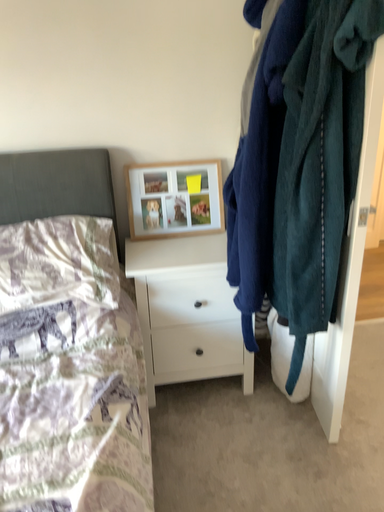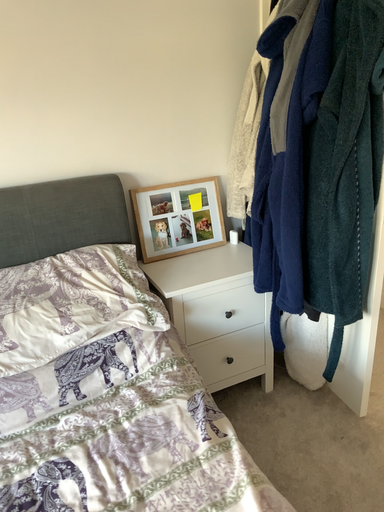
Question: How did the camera likely rotate when shooting the video?

Choices:
 (A) rotated left
 (B) rotated right

Answer: (B)